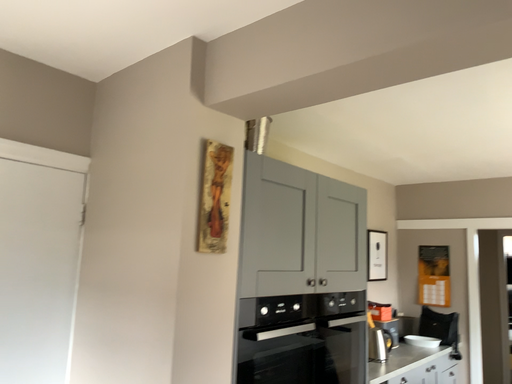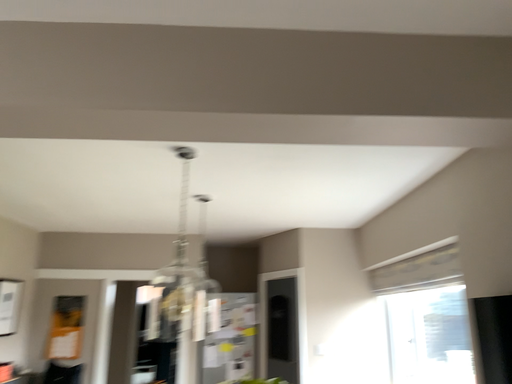
Question: How did the camera likely rotate when shooting the video?

Choices:
 (A) rotated right
 (B) rotated left

Answer: (A)